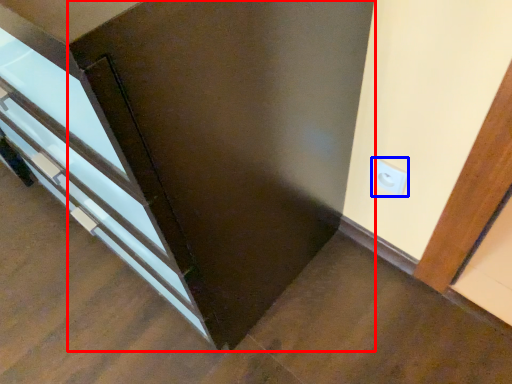
Question: Which point is closer to the camera, door (highlighted by a red box) or electric outlet (highlighted by a blue box)?

Choices:
 (A) door
 (B) electric outlet

Answer: (A)